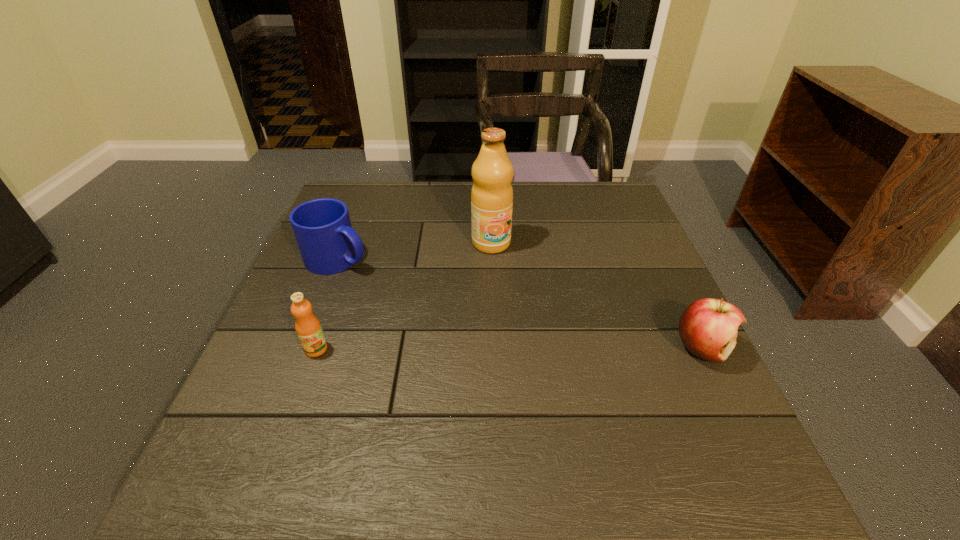
Where is `vacant area located 0.280m on the side with the handle of the mug`? The width and height of the screenshot is (960, 540). vacant area located 0.280m on the side with the handle of the mug is located at coordinates (455, 309).

Image resolution: width=960 pixels, height=540 pixels. I want to click on vacant space located 0.310m on the side with the handle of the mug, so click(466, 314).

I want to click on free space located on the side with the handle of the mug, so [x=385, y=278].

Locate an element on the screen. This screenshot has width=960, height=540. orange juice at the left edge is located at coordinates (308, 328).

At what (x,y) coordinates should I click in order to perform the action: click on mug positioned at the left edge. Please return your answer as a coordinate pair (x, y). Looking at the image, I should click on (328, 244).

Where is `object positioned at the right edge`? This screenshot has height=540, width=960. object positioned at the right edge is located at coordinates (708, 327).

The width and height of the screenshot is (960, 540). I want to click on free space at the far edge of the desktop, so click(398, 217).

At what (x,y) coordinates should I click in order to perform the action: click on vacant region at the left edge of the desktop. Please return your answer as a coordinate pair (x, y). This screenshot has height=540, width=960. Looking at the image, I should click on (277, 340).

This screenshot has width=960, height=540. Identify the location of vacant area at the right edge of the desktop. (652, 296).

Where is `free space at the near left corner of the desktop`? This screenshot has width=960, height=540. free space at the near left corner of the desktop is located at coordinates (262, 439).